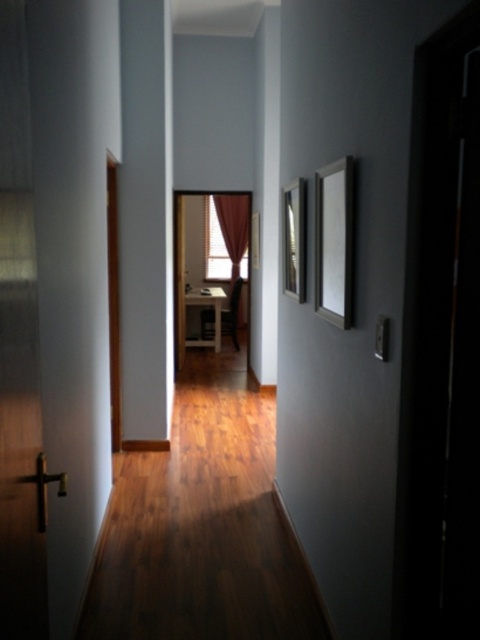
You are moving a tall painting that is 2 meters in height and need to pass through the hallway. Based on the scene, will the painting fit vertically between the black glossy door at right and the matte white curtain at center?

The black glossy door at right has a greater height compared to matte white curtain at center. Since the painting is 2 meters tall, and the door is taller than the curtain, the painting may not fit vertically between them as the height difference could create an obstruction.

You are standing in the hallway and need to locate the black glossy door at right. According to the scene description, where should you look to find it?

The black glossy door at right is located at the right side of the hallway, as indicated by its 2D coordinates at point (441, 346).

You are moving a large painting that is 1.2 meters wide. You want to place it on the wall between the black glossy door at right and the matte white curtain at center. Can the painting fit in that space?

The black glossy door at right is smaller than the matte white curtain at center, so the space between them might be sufficient. However, since the exact width of the space isn not provided, it is uncertain if the 1.2 meter painting will fit. Check the actual dimensions before placing it.